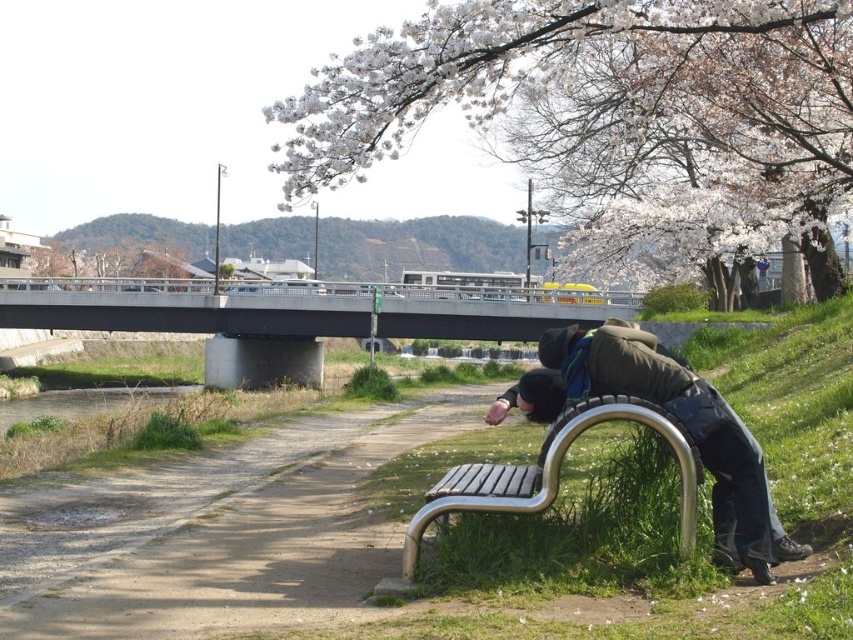
Who is lower down, white blossoms at upper center or wooden slats bench at lower center?

wooden slats bench at lower center is lower down.

Can you confirm if white blossoms at upper center is positioned above wooden slats bench at lower center?

Yes.

The height and width of the screenshot is (640, 853). I want to click on white blossoms at upper center, so click(x=598, y=93).

Where is `white blossoms at upper center`? white blossoms at upper center is located at coordinates (598, 93).

Can you confirm if dirt path at lower left is positioned to the right of matte green jacket at lower right?

No, dirt path at lower left is not to the right of matte green jacket at lower right.

Where is `dirt path at lower left`? The width and height of the screenshot is (853, 640). dirt path at lower left is located at coordinates (245, 548).

Who is shorter, dirt path at lower left or wooden slats bench at lower center?

With less height is dirt path at lower left.

This screenshot has height=640, width=853. Find the location of `dirt path at lower left`. dirt path at lower left is located at coordinates (245, 548).

Identify the location of dirt path at lower left. (245, 548).